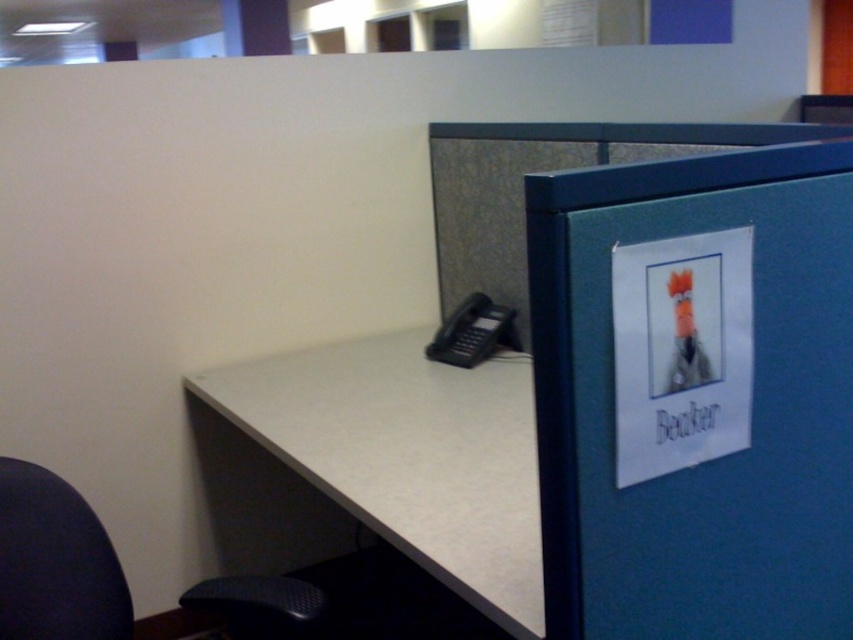
You are organizing an office space and need to move the blue felt file cabinet at right and the dark blue fabric swivel chair at lower left. Which object requires more space to move due to its size?

The blue felt file cabinet at right requires more space to move because it is larger in size than the dark blue fabric swivel chair at lower left.

Consider the image. You are a delivery person standing in front of the blue felt file cabinet at right. You need to place a package that is 28 inches wide on the floor. Is there enough space between you and the file cabinet to place the package?

The distance between the blue felt file cabinet at right and the viewer is 30.20 inches. Since the package is 28 inches wide, there is enough space to place it between you and the cabinet.

You are an office worker who needs to move a box from the white laminate desk at center to the dark blue fabric swivel chair at lower left. Can you place the box directly in front of the chair without moving the chair?

The white laminate desk at center might be wider than dark blue fabric swivel chair at lower left, so there might not be enough space to place the box directly in front of the chair without moving it.